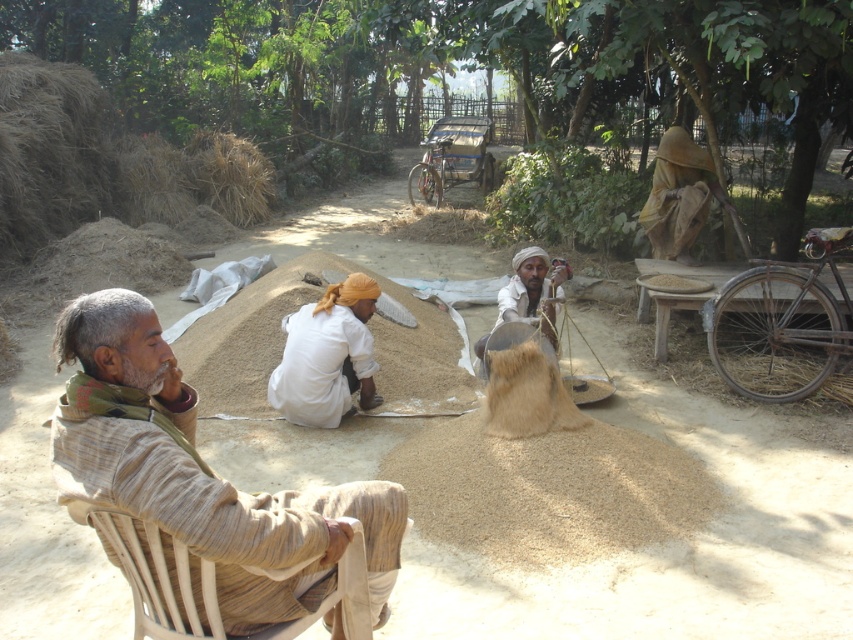
Between woven wood chair at left and white cotton turban at center, which one is positioned lower?

woven wood chair at left is lower down.

Does woven wood chair at left have a lesser width compared to white cotton turban at center?

Incorrect, woven wood chair at left's width is not less than white cotton turban at center's.

Between point (126, 534) and point (350, 292), which one is positioned in front?

Positioned in front is point (126, 534).

You are a GUI agent. You are given a task and a screenshot of the screen. Output one action in this format:
    pyautogui.click(x=<x>, y=<y>)
    Task: Click on the woven wood chair at left
    
    Given the screenshot: What is the action you would take?
    pyautogui.click(x=212, y=582)

Can you confirm if woven wood chair at left is positioned to the left of light brown fabric at center?

Yes, woven wood chair at left is to the left of light brown fabric at center.

Is point (287, 628) less distant than point (508, 285)?

Yes, point (287, 628) is in front of point (508, 285).

What are the coordinates of `woven wood chair at left` in the screenshot? It's located at (212, 582).

Is beige fabric chair at left above light brown fabric at center?

No.

Who is more forward, (170, 508) or (503, 312)?

Positioned in front is point (170, 508).

Looking at this image, who is more forward, (x=291, y=541) or (x=556, y=339)?

Point (x=291, y=541)

Where is `beige fabric chair at left`? The width and height of the screenshot is (853, 640). beige fabric chair at left is located at coordinates (199, 474).